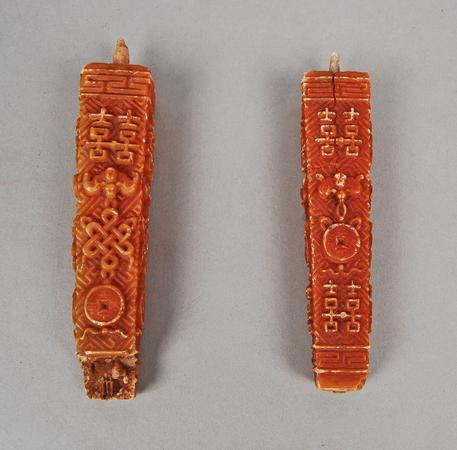
The image size is (457, 450). I want to click on bottom of candle, so click(346, 380).